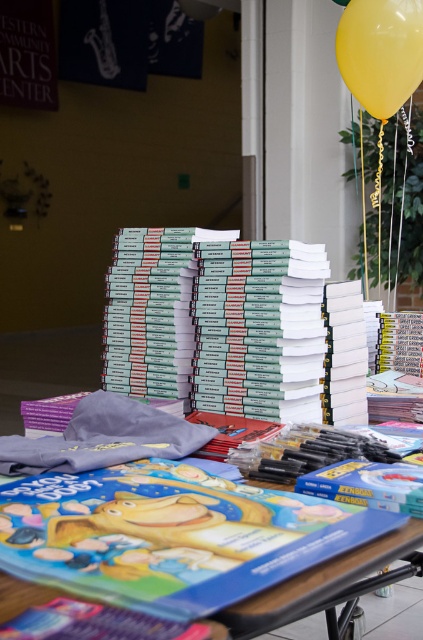
Question: Is green matte book at center positioned in front of matte plastic table at center?

Choices:
 (A) no
 (B) yes

Answer: (B)

Question: Which object is closer to the camera taking this photo?

Choices:
 (A) green matte book at center
 (B) matte plastic table at center
 (C) yellow rubber balloon at upper right

Answer: (A)

Question: Which object appears closest to the camera in this image?

Choices:
 (A) matte plastic table at center
 (B) yellow rubber balloon at upper right
 (C) green matte book at center

Answer: (C)

Question: Which point is closer to the camera?

Choices:
 (A) (57, 397)
 (B) (200, 276)

Answer: (B)

Question: Is green matte book at center in front of matte plastic table at center?

Choices:
 (A) yes
 (B) no

Answer: (A)

Question: Considering the relative positions of green matte book at center and yellow rubber balloon at upper right in the image provided, where is green matte book at center located with respect to yellow rubber balloon at upper right?

Choices:
 (A) left
 (B) right

Answer: (A)